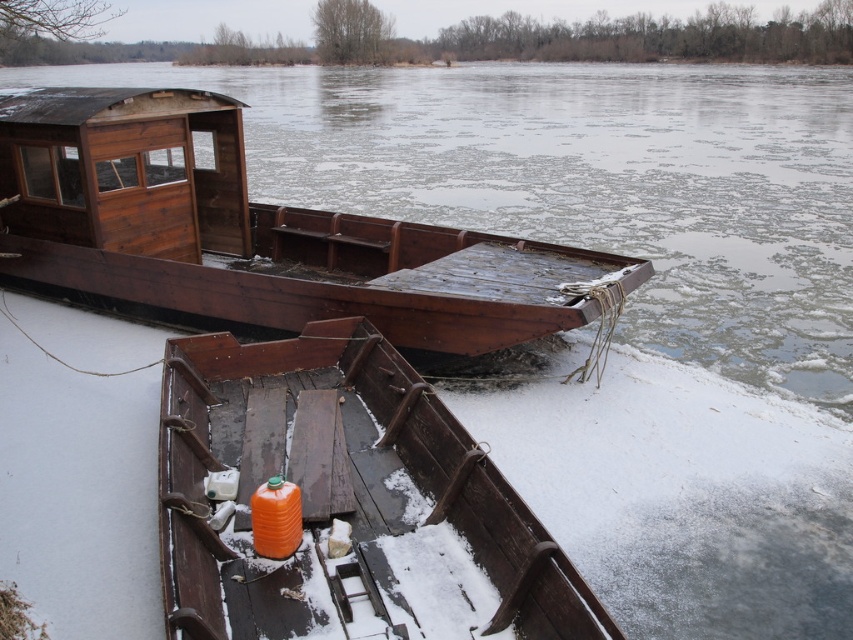
Does orange matte plastic container at center have a greater height compared to wooden boat at center?

No.

Who is shorter, orange matte plastic container at center or wooden boat at center?

With less height is orange matte plastic container at center.

This screenshot has height=640, width=853. What are the coordinates of `orange matte plastic container at center` in the screenshot? It's located at (344, 502).

Identify the location of orange matte plastic container at center. (344, 502).